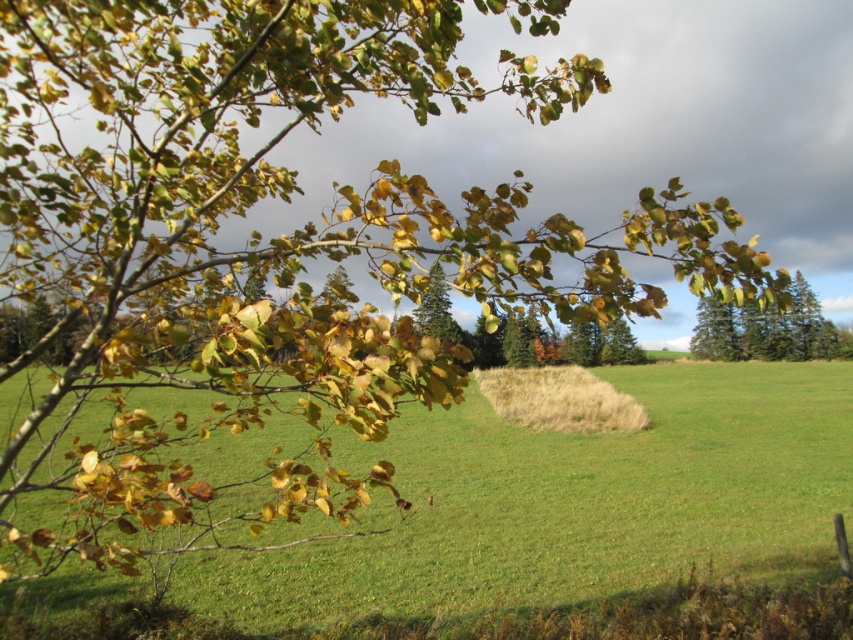
Question: Which of the following is the closest to the observer?

Choices:
 (A) (430, 294)
 (B) (541, 388)
 (C) (747, 342)

Answer: (B)

Question: Can you confirm if green grass pasture at lower left is smaller than green matte tree at upper right?

Choices:
 (A) no
 (B) yes

Answer: (B)

Question: Which point is closer to the camera?

Choices:
 (A) (761, 339)
 (B) (509, 400)
 (C) (440, 314)

Answer: (B)

Question: Which of these objects is positioned farthest from the dry grass at center?

Choices:
 (A) green grass pasture at lower left
 (B) green matte tree at upper right
 (C) green matte tree at center

Answer: (B)

Question: Does green matte tree at upper right appear on the right side of green matte tree at center?

Choices:
 (A) no
 (B) yes

Answer: (B)

Question: Can you confirm if green grass pasture at lower left is bigger than dry grass at center?

Choices:
 (A) yes
 (B) no

Answer: (A)